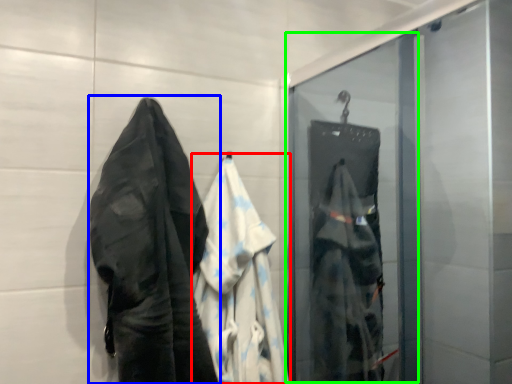
Question: Which object is positioned farthest from garment (highlighted by a red box)? Select from towel (highlighted by a blue box) and screen door (highlighted by a green box).

Choices:
 (A) towel
 (B) screen door

Answer: (B)